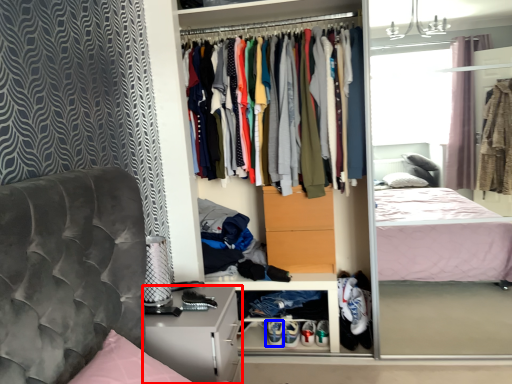
Question: Which object is further to the camera taking this photo, nightstand (highlighted by a red box) or footwear (highlighted by a blue box)?

Choices:
 (A) nightstand
 (B) footwear

Answer: (B)